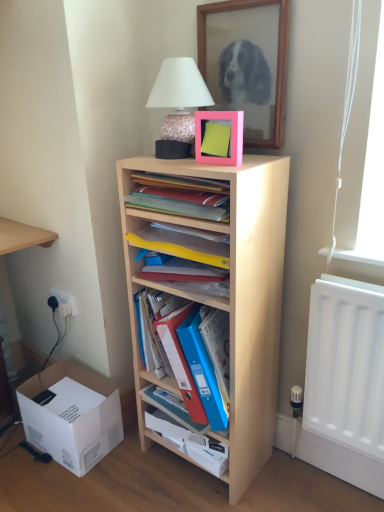
Question: From the image's perspective, is white cardboard box at lower left under light wood shelf at center, the second shelf in the bottom-to-top sequence?

Choices:
 (A) no
 (B) yes

Answer: (B)

Question: From a real-world perspective, is white cardboard box at lower left on light wood shelf at center, acting as the 3th shelf starting from the top?

Choices:
 (A) no
 (B) yes

Answer: (A)

Question: Is the position of white cardboard box at lower left less distant than that of light wood shelf at center, acting as the 3th shelf starting from the top?

Choices:
 (A) yes
 (B) no

Answer: (B)

Question: Would you say white cardboard box at lower left contains light wood shelf at center, acting as the 3th shelf starting from the top?

Choices:
 (A) no
 (B) yes

Answer: (A)

Question: From the image's perspective, is white cardboard box at lower left on light wood shelf at center, acting as the 3th shelf starting from the top?

Choices:
 (A) yes
 (B) no

Answer: (B)

Question: From a real-world perspective, is white plastic electric outlet at lower left, arranged as the second electric outlet when viewed from the left, positioned above or below light wood shelf at center, the second shelf in the bottom-to-top sequence?

Choices:
 (A) above
 (B) below

Answer: (B)

Question: Is white plastic electric outlet at lower left, the first electric outlet viewed from the right, situated inside light wood shelf at center, acting as the 3th shelf starting from the top, or outside?

Choices:
 (A) outside
 (B) inside

Answer: (A)

Question: Relative to light wood shelf at center, acting as the 3th shelf starting from the top, is white plastic electric outlet at lower left, the first electric outlet viewed from the right, in front or behind?

Choices:
 (A) behind
 (B) front

Answer: (A)

Question: Considering the positions of white plastic electric outlet at lower left, arranged as the second electric outlet when viewed from the left, and light wood shelf at center, the second shelf in the bottom-to-top sequence, in the image, is white plastic electric outlet at lower left, arranged as the second electric outlet when viewed from the left, bigger or smaller than light wood shelf at center, the second shelf in the bottom-to-top sequence,?

Choices:
 (A) big
 (B) small

Answer: (B)

Question: Considering the positions of blue plastic folders at center and white plastic electric outlet at lower left, the first electric outlet in the left-to-right sequence, in the image, is blue plastic folders at center taller or shorter than white plastic electric outlet at lower left, the first electric outlet in the left-to-right sequence,?

Choices:
 (A) short
 (B) tall

Answer: (B)

Question: In the image, is blue plastic folders at center positioned in front of or behind white plastic electric outlet at lower left, arranged as the 2th electric outlet when viewed from the right?

Choices:
 (A) front
 (B) behind

Answer: (A)

Question: In terms of width, does blue plastic folders at center look wider or thinner when compared to white plastic electric outlet at lower left, the first electric outlet in the left-to-right sequence?

Choices:
 (A) wide
 (B) thin

Answer: (A)

Question: Choose the correct answer: Is blue plastic folders at center inside white plastic electric outlet at lower left, the first electric outlet in the left-to-right sequence, or outside it?

Choices:
 (A) outside
 (B) inside

Answer: (A)

Question: Would you say blue plastic folders at center is to the left or to the right of white plastic electric outlet at lower left, arranged as the second electric outlet when viewed from the left, in the picture?

Choices:
 (A) left
 (B) right

Answer: (B)

Question: Is point (172, 413) closer or farther from the camera than point (59, 311)?

Choices:
 (A) farther
 (B) closer

Answer: (B)